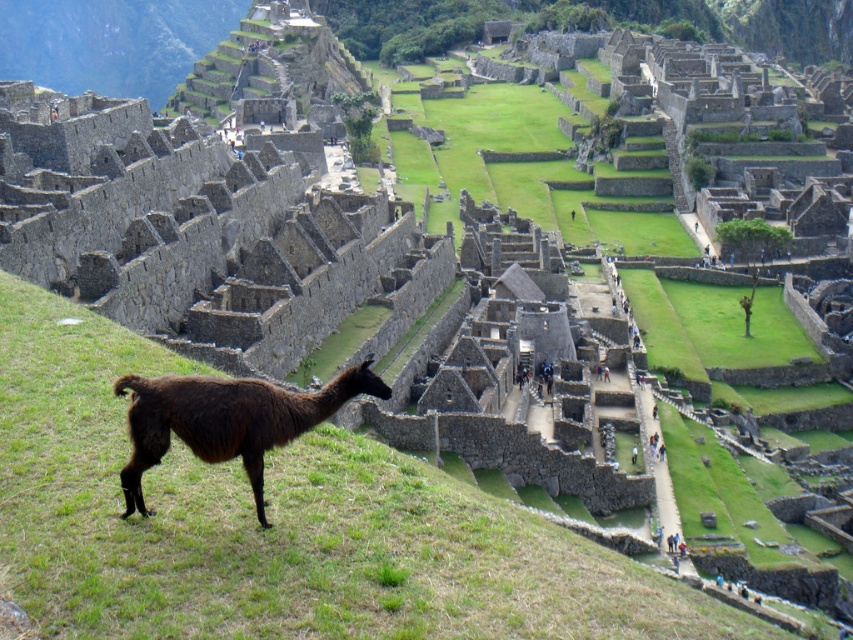
Between stone ruins at center and brown woolly alpaca at lower left, which one appears on the left side from the viewer's perspective?

stone ruins at center

The width and height of the screenshot is (853, 640). I want to click on stone ruins at center, so click(x=201, y=232).